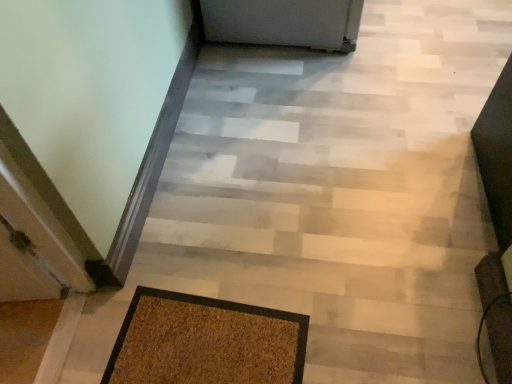
Image resolution: width=512 pixels, height=384 pixels. In order to click on vacant area located to the right-hand side of brown textured mat at lower center in this screenshot , I will do `click(345, 318)`.